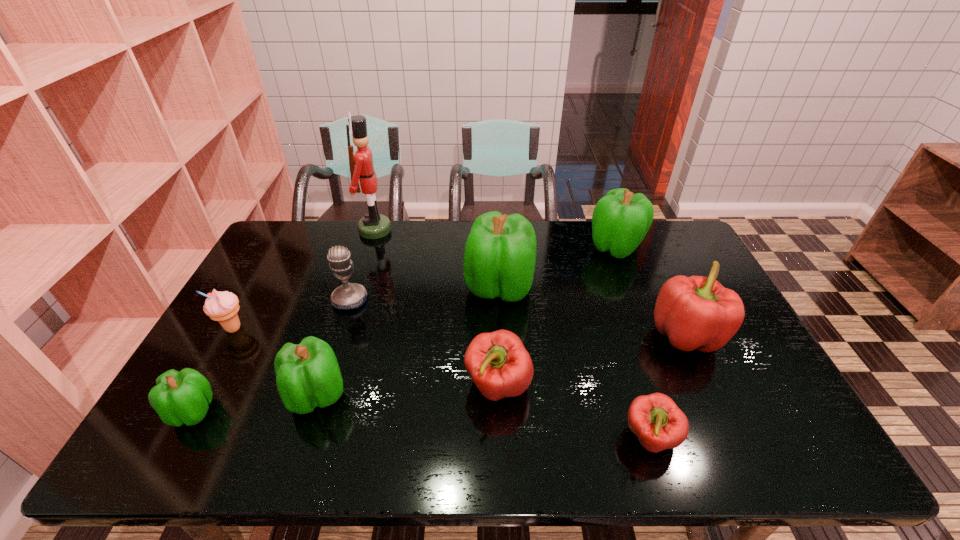
Where is `the second biggest pink bell pepper`? the second biggest pink bell pepper is located at coordinates (498, 363).

The height and width of the screenshot is (540, 960). I want to click on icecream, so click(x=220, y=306).

What are the coordinates of `the leftmost bell pepper` in the screenshot? It's located at (183, 397).

You are a GUI agent. You are given a task and a screenshot of the screen. Output one action in this format:
    pyautogui.click(x=<x>, y=<y>)
    Task: Click on the smallest green bell pepper
    The width and height of the screenshot is (960, 540).
    Given the screenshot: What is the action you would take?
    pyautogui.click(x=183, y=397)

Identify the location of the second pink bell pepper from left to right. This screenshot has width=960, height=540. (655, 419).

What are the coordinates of `vacant space located 0.310m on the front-facing side of the nutcracker` in the screenshot? It's located at (474, 230).

The width and height of the screenshot is (960, 540). I want to click on free space located on the front of the biggest green bell pepper, so click(505, 410).

At what (x,y) coordinates should I click in order to perform the action: click on vacant area situated on the front of the second biggest green bell pepper. Please return your answer as a coordinate pair (x, y). The width and height of the screenshot is (960, 540). Looking at the image, I should click on (647, 330).

The image size is (960, 540). I want to click on free region located 0.390m on the front-facing side of the microphone, so click(308, 432).

Locate an element on the screen. Image resolution: width=960 pixels, height=540 pixels. vacant position located 0.260m on the left of the biggest pink bell pepper is located at coordinates (559, 335).